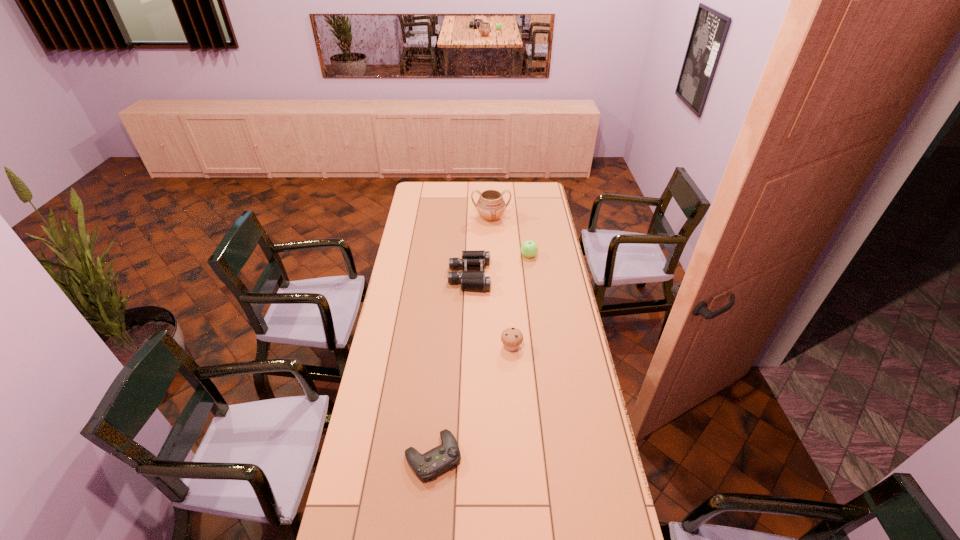
The image size is (960, 540). What are the coordinates of `vacant area located on the front of the muffin` in the screenshot? It's located at (518, 450).

You are a GUI agent. You are given a task and a screenshot of the screen. Output one action in this format:
    pyautogui.click(x=<x>, y=<y>)
    Task: Click on the vacant space located 0.120m on the front of the control
    
    Given the screenshot: What is the action you would take?
    pyautogui.click(x=427, y=525)

Image resolution: width=960 pixels, height=540 pixels. Identify the location of object present at the right edge. (529, 248).

At what (x,y) coordinates should I click in order to perform the action: click on vacant space at the far edge. Please return your answer as a coordinate pair (x, y). The height and width of the screenshot is (540, 960). Looking at the image, I should click on coord(442,194).

The height and width of the screenshot is (540, 960). In the image, there is a desktop. Identify the location of free space at the left edge. (407, 240).

At what (x,y) coordinates should I click in order to perform the action: click on vacant space at the right edge. Please return your answer as a coordinate pair (x, y). The width and height of the screenshot is (960, 540). Looking at the image, I should click on (568, 309).

Where is `empty space between the tallest object and the muffin`? The width and height of the screenshot is (960, 540). empty space between the tallest object and the muffin is located at coordinates (501, 282).

I want to click on free space that is in between the muffin and the urn, so click(501, 282).

The image size is (960, 540). Find the location of `free spot between the farthest object and the binoculars`. free spot between the farthest object and the binoculars is located at coordinates (480, 247).

Identify the location of empty space that is in between the farthest object and the fourth farthest object. (501, 282).